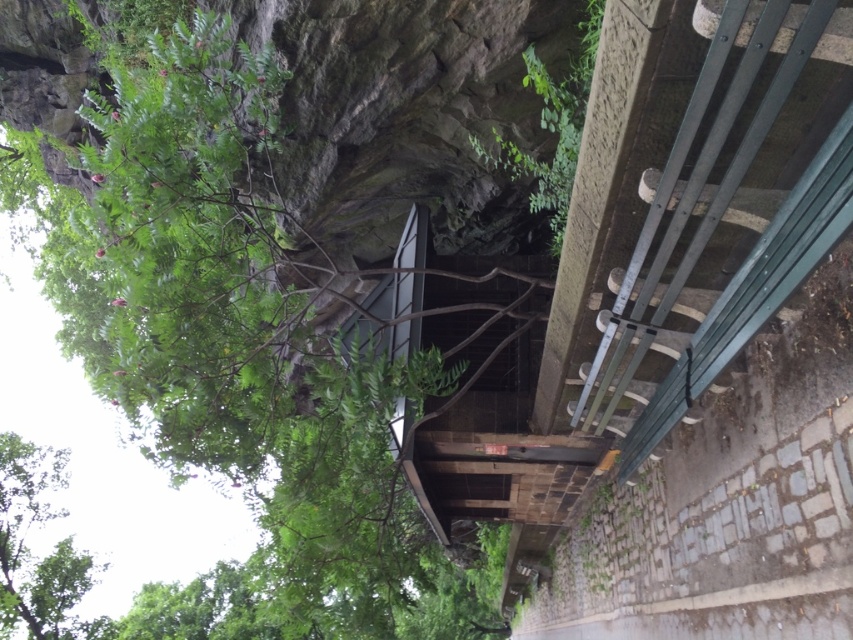
Between point (154, 294) and point (19, 525), which one is positioned behind?

Point (19, 525)

Does green leafy tree at upper left have a larger size compared to green leafy tree at lower left?

Yes, green leafy tree at upper left is bigger than green leafy tree at lower left.

Who is more distant from viewer, (x=398, y=497) or (x=3, y=577)?

The point (x=3, y=577) is behind.

Locate an element on the screen. green leafy tree at upper left is located at coordinates pyautogui.click(x=234, y=342).